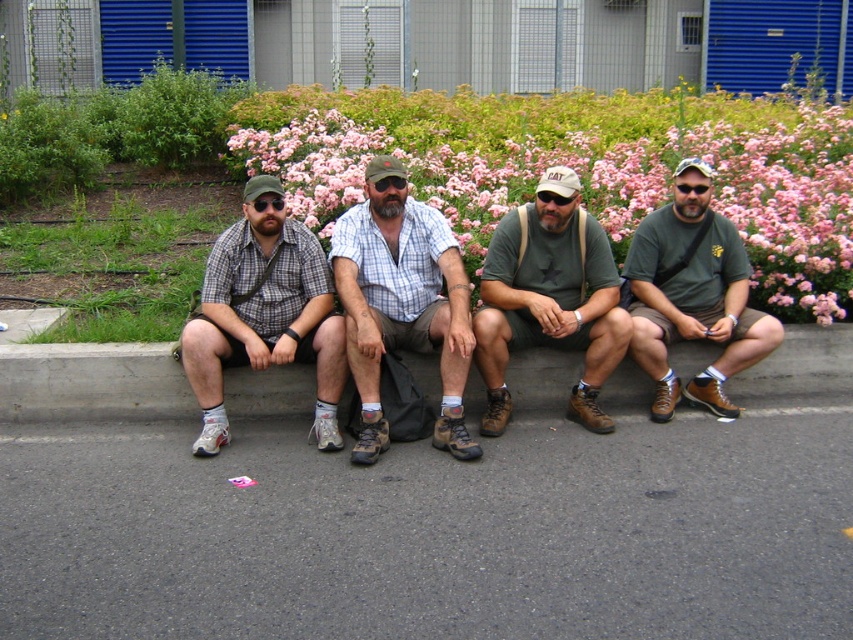
You are a photographer trying to capture a closeup of the pink soft petals at center and the plaid fabric shirt at center. Which object should you focus on first if you want to ensure both are in focus without moving the camera?

The pink soft petals at center is shorter than the plaid fabric shirt at center, so you should focus on the plaid fabric shirt at center first because it is farther away. This way, the depth of field will cover both objects more effectively.